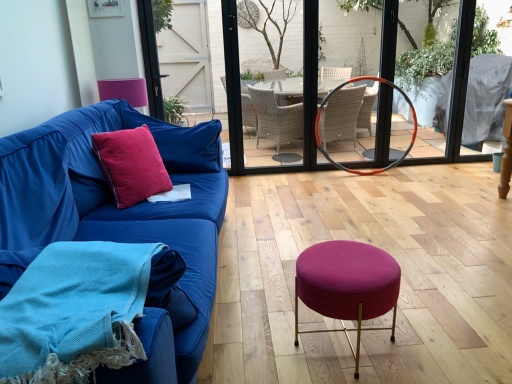
Question: Considering the relative sizes of orange rubber hula hoop at center and pink velvet armchair at upper left in the image provided, is orange rubber hula hoop at center thinner than pink velvet armchair at upper left?

Choices:
 (A) no
 (B) yes

Answer: (B)

Question: From the image's perspective, is orange rubber hula hoop at center located beneath pink velvet armchair at upper left?

Choices:
 (A) yes
 (B) no

Answer: (A)

Question: Is pink velvet armchair at upper left a part of orange rubber hula hoop at center?

Choices:
 (A) yes
 (B) no

Answer: (B)

Question: Is orange rubber hula hoop at center positioned in front of pink velvet armchair at upper left?

Choices:
 (A) no
 (B) yes

Answer: (A)

Question: Is orange rubber hula hoop at center bigger than pink velvet armchair at upper left?

Choices:
 (A) yes
 (B) no

Answer: (A)

Question: From a real-world perspective, is pink velvet pillow at left physically located above or below woolen blue blanket at lower left?

Choices:
 (A) above
 (B) below

Answer: (A)

Question: From the image's perspective, is pink velvet pillow at left above or below woolen blue blanket at lower left?

Choices:
 (A) above
 (B) below

Answer: (A)

Question: Is pink velvet pillow at left in front of or behind woolen blue blanket at lower left in the image?

Choices:
 (A) behind
 (B) front

Answer: (A)

Question: Considering the positions of pink velvet pillow at left and woolen blue blanket at lower left in the image, is pink velvet pillow at left taller or shorter than woolen blue blanket at lower left?

Choices:
 (A) short
 (B) tall

Answer: (B)

Question: From a real-world perspective, is clear glass door at center positioned above or below pink velvet pillow at left?

Choices:
 (A) below
 (B) above

Answer: (B)

Question: Is clear glass door at center to the left or to the right of pink velvet pillow at left in the image?

Choices:
 (A) left
 (B) right

Answer: (B)

Question: Is clear glass door at center wider or thinner than pink velvet pillow at left?

Choices:
 (A) thin
 (B) wide

Answer: (A)

Question: Does point (241, 38) appear closer or farther from the camera than point (156, 119)?

Choices:
 (A) farther
 (B) closer

Answer: (A)

Question: From a real-world perspective, is orange rubber hula hoop at center positioned above or below velvet cushion at left?

Choices:
 (A) below
 (B) above

Answer: (A)

Question: In the image, is orange rubber hula hoop at center positioned in front of or behind velvet cushion at left?

Choices:
 (A) front
 (B) behind

Answer: (B)